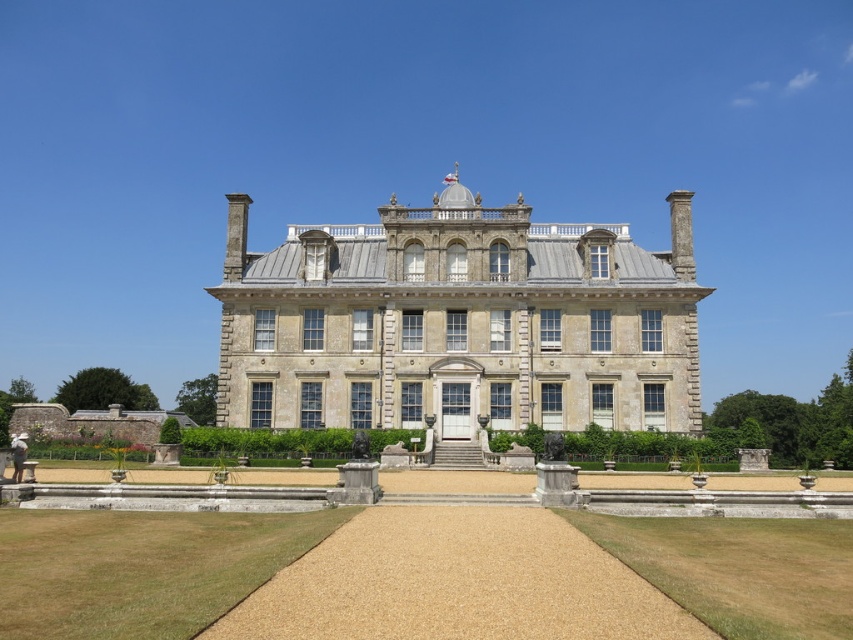
Does point (561, 387) come behind point (242, 586)?

Yes, point (561, 387) is farther from viewer.

Between point (241, 196) and point (184, 602), which one is positioned behind?

The point (241, 196) is more distant.

I want to click on stone mansion at center, so click(x=459, y=323).

Between point (383, 296) and point (602, 541), which one is positioned in front?

Point (602, 541) is in front.

Locate an element on the screen. stone mansion at center is located at coordinates (459, 323).

Which is more to the right, green grass at lower center or green grass at lower right?

green grass at lower right is more to the right.

Image resolution: width=853 pixels, height=640 pixels. I want to click on green grass at lower center, so click(140, 568).

Image resolution: width=853 pixels, height=640 pixels. I want to click on green grass at lower center, so click(140, 568).